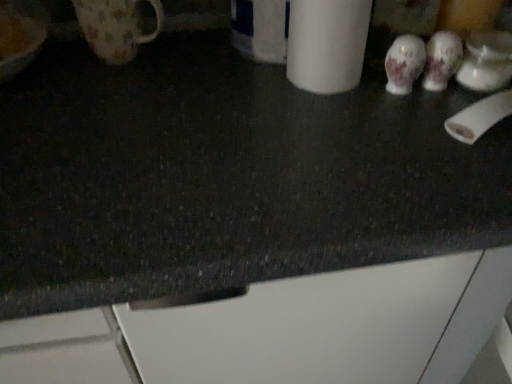
Locate an element on the screen. white matte paper towel at upper right is located at coordinates (327, 44).

What is the approximate height of floral ceramic mug at upper left, the first mug when ordered from left to right?

4.76 inches.

How much space does white porcelain mug at upper right, arranged as the first mug when viewed from the right, occupy vertically?

white porcelain mug at upper right, arranged as the first mug when viewed from the right, is 2.52 inches in height.

You are a GUI agent. You are given a task and a screenshot of the screen. Output one action in this format:
    pyautogui.click(x=<x>, y=<y>)
    Task: Click on the white matte toilet paper at right
    Image resolution: width=512 pixels, height=384 pixels.
    Given the screenshot: What is the action you would take?
    pyautogui.click(x=479, y=117)

Looking at this image, considering the positions of objects white matte toilet paper at right and floral ceramic mug at upper left, the first mug when ordered from left to right, in the image provided, who is more to the left, white matte toilet paper at right or floral ceramic mug at upper left, the first mug when ordered from left to right,?

Positioned to the left is floral ceramic mug at upper left, the first mug when ordered from left to right.

Consider the image. Is white matte toilet paper at right looking in the opposite direction of floral ceramic mug at upper left, the second mug from the right?

No.

Considering the points (492, 125) and (128, 2), which point is in front, point (492, 125) or point (128, 2)?

Point (492, 125)

From a real-world perspective, who is located lower, white matte toilet paper at right or floral ceramic mug at upper left, the second mug from the right?

From a 3D spatial view, white matte toilet paper at right is below.

How many degrees apart are the facing directions of white matte paper towel at upper right and floral ceramic mug at upper left, the second mug from the right?

The angle between the facing direction of white matte paper towel at upper right and the facing direction of floral ceramic mug at upper left, the second mug from the right, is 0.000435 degrees.

Based on their positions, is white matte paper towel at upper right located to the left or right of floral ceramic mug at upper left, the second mug from the right?

From the image, it's evident that white matte paper towel at upper right is to the right of floral ceramic mug at upper left, the second mug from the right.

Between white matte paper towel at upper right and floral ceramic mug at upper left, the first mug when ordered from left to right, which one has larger size?

white matte paper towel at upper right.

From the image's perspective, relative to floral ceramic mug at upper left, the first mug when ordered from left to right, is white matte paper towel at upper right above or below?

Based on their image positions, white matte paper towel at upper right is located beneath floral ceramic mug at upper left, the first mug when ordered from left to right.

Considering the sizes of objects white matte paper towel at upper right and white porcelain mug at upper right, arranged as the first mug when viewed from the right, in the image provided, who is bigger, white matte paper towel at upper right or white porcelain mug at upper right, arranged as the first mug when viewed from the right,?

white matte paper towel at upper right is bigger.

From the image's perspective, does white matte paper towel at upper right appear higher than white porcelain mug at upper right, the 2th mug from the left?

Yes, from the image's perspective, white matte paper towel at upper right is on top of white porcelain mug at upper right, the 2th mug from the left.

How different are the orientations of white matte paper towel at upper right and white porcelain mug at upper right, the 2th mug from the left, in degrees?

The angle between the facing direction of white matte paper towel at upper right and the facing direction of white porcelain mug at upper right, the 2th mug from the left, is 0.00208 degrees.

From a real-world perspective, is white matte paper towel at upper right located beneath white porcelain mug at upper right, the 2th mug from the left?

No, from a real-world perspective, white matte paper towel at upper right is not below white porcelain mug at upper right, the 2th mug from the left.

Could you tell me if white porcelain mug at upper right, the 2th mug from the left, is turned towards white matte toilet paper at right?

Yes, white porcelain mug at upper right, the 2th mug from the left, is facing white matte toilet paper at right.

Considering the sizes of white porcelain mug at upper right, arranged as the first mug when viewed from the right, and white matte toilet paper at right in the image, is white porcelain mug at upper right, arranged as the first mug when viewed from the right, taller or shorter than white matte toilet paper at right?

Clearly, white porcelain mug at upper right, arranged as the first mug when viewed from the right, is taller compared to white matte toilet paper at right.

Is white porcelain mug at upper right, the 2th mug from the left, not close to white matte toilet paper at right?

No, white porcelain mug at upper right, the 2th mug from the left, is not far away from white matte toilet paper at right.

Do you think white porcelain mug at upper right, arranged as the first mug when viewed from the right, is within white matte toilet paper at right, or outside of it?

white porcelain mug at upper right, arranged as the first mug when viewed from the right, is not enclosed by white matte toilet paper at right.

Which object is positioned more to the right, white matte toilet paper at right or white porcelain mug at upper right, the 2th mug from the left?

From the viewer's perspective, white matte toilet paper at right appears more on the right side.

Is white matte toilet paper at right positioned far away from white porcelain mug at upper right, arranged as the first mug when viewed from the right?

white matte toilet paper at right is actually quite close to white porcelain mug at upper right, arranged as the first mug when viewed from the right.

How much distance is there between white matte toilet paper at right and white porcelain mug at upper right, the 2th mug from the left?

white matte toilet paper at right and white porcelain mug at upper right, the 2th mug from the left, are 3.09 inches apart from each other.

Is white matte toilet paper at right aimed at white porcelain mug at upper right, arranged as the first mug when viewed from the right?

No.

Would you say white porcelain mug at upper right, arranged as the first mug when viewed from the right, is to the left or to the right of floral ceramic mug at upper left, the first mug when ordered from left to right, in the picture?

Clearly, white porcelain mug at upper right, arranged as the first mug when viewed from the right, is on the right of floral ceramic mug at upper left, the first mug when ordered from left to right, in the image.

Is white porcelain mug at upper right, the 2th mug from the left, aimed at floral ceramic mug at upper left, the first mug when ordered from left to right?

No, white porcelain mug at upper right, the 2th mug from the left, is not oriented towards floral ceramic mug at upper left, the first mug when ordered from left to right.

From a real-world perspective, is white porcelain mug at upper right, arranged as the first mug when viewed from the right, under floral ceramic mug at upper left, the second mug from the right?

Correct, in the physical world, white porcelain mug at upper right, arranged as the first mug when viewed from the right, is lower than floral ceramic mug at upper left, the second mug from the right.

Is white porcelain mug at upper right, arranged as the first mug when viewed from the right, inside or outside of floral ceramic mug at upper left, the second mug from the right?

white porcelain mug at upper right, arranged as the first mug when viewed from the right, is located beyond the bounds of floral ceramic mug at upper left, the second mug from the right.

The height and width of the screenshot is (384, 512). I want to click on the 1st mug directly beneath the white matte paper towel at upper right (from a real-world perspective), so click(x=115, y=27).

Is floral ceramic mug at upper left, the second mug from the right, positioned behind white matte paper towel at upper right?

Yes.

Is floral ceramic mug at upper left, the second mug from the right, facing towards white matte paper towel at upper right?

No.

Who is bigger, floral ceramic mug at upper left, the second mug from the right, or white matte paper towel at upper right?

Bigger between the two is white matte paper towel at upper right.

Where is `the 2nd mug directly above the white matte toilet paper at right (from a real-world perspective)`? The image size is (512, 384). the 2nd mug directly above the white matte toilet paper at right (from a real-world perspective) is located at coordinates (115, 27).

Locate an element on the screen. The width and height of the screenshot is (512, 384). paper towel that is on the right side of floral ceramic mug at upper left, the second mug from the right is located at coordinates (327, 44).

From the image, which object appears to be farther from white porcelain mug at upper right, arranged as the first mug when viewed from the right, white matte paper towel at upper right or floral ceramic mug at upper left, the first mug when ordered from left to right?

Among the two, floral ceramic mug at upper left, the first mug when ordered from left to right, is located further to white porcelain mug at upper right, arranged as the first mug when viewed from the right.

Based on their spatial positions, is white porcelain mug at upper right, arranged as the first mug when viewed from the right, or white matte paper towel at upper right closer to floral ceramic mug at upper left, the second mug from the right?

white matte paper towel at upper right is positioned closer to the anchor floral ceramic mug at upper left, the second mug from the right.

From the image, which object appears to be nearer to white matte paper towel at upper right, white porcelain mug at upper right, arranged as the first mug when viewed from the right, or floral ceramic mug at upper left, the first mug when ordered from left to right?

white porcelain mug at upper right, arranged as the first mug when viewed from the right, is closer to white matte paper towel at upper right.

From the image, which object appears to be nearer to white porcelain mug at upper right, the 2th mug from the left, white matte toilet paper at right or floral ceramic mug at upper left, the first mug when ordered from left to right?

Among the two, white matte toilet paper at right is located nearer to white porcelain mug at upper right, the 2th mug from the left.

Based on the photo, estimate the real-world distances between objects in this image. Which object is further from white porcelain mug at upper right, arranged as the first mug when viewed from the right, floral ceramic mug at upper left, the first mug when ordered from left to right, or white matte paper towel at upper right?

floral ceramic mug at upper left, the first mug when ordered from left to right, lies further to white porcelain mug at upper right, arranged as the first mug when viewed from the right, than the other object.

Estimate the real-world distances between objects in this image. Which object is closer to white matte paper towel at upper right, white porcelain mug at upper right, the 2th mug from the left, or white matte toilet paper at right?

Among the two, white matte toilet paper at right is located nearer to white matte paper towel at upper right.

Looking at the image, which one is located closer to floral ceramic mug at upper left, the second mug from the right, white matte paper towel at upper right or white matte toilet paper at right?

white matte paper towel at upper right lies closer to floral ceramic mug at upper left, the second mug from the right, than the other object.

From the image, which object appears to be nearer to white porcelain mug at upper right, arranged as the first mug when viewed from the right, white matte toilet paper at right or white matte paper towel at upper right?

white matte toilet paper at right lies closer to white porcelain mug at upper right, arranged as the first mug when viewed from the right, than the other object.

This screenshot has height=384, width=512. What are the coordinates of `paper towel between floral ceramic mug at upper left, the first mug when ordered from left to right, and white matte toilet paper at right from left to right` in the screenshot? It's located at (327, 44).

Locate an element on the screen. The image size is (512, 384). mug between floral ceramic mug at upper left, the first mug when ordered from left to right, and white matte toilet paper at right, in the horizontal direction is located at coordinates (486, 61).

Image resolution: width=512 pixels, height=384 pixels. In order to click on mug between white matte paper towel at upper right and white matte toilet paper at right from left to right in this screenshot , I will do `click(486, 61)`.

The image size is (512, 384). Find the location of `paper towel between floral ceramic mug at upper left, the second mug from the right, and white porcelain mug at upper right, the 2th mug from the left, in the horizontal direction`. paper towel between floral ceramic mug at upper left, the second mug from the right, and white porcelain mug at upper right, the 2th mug from the left, in the horizontal direction is located at coordinates (327, 44).